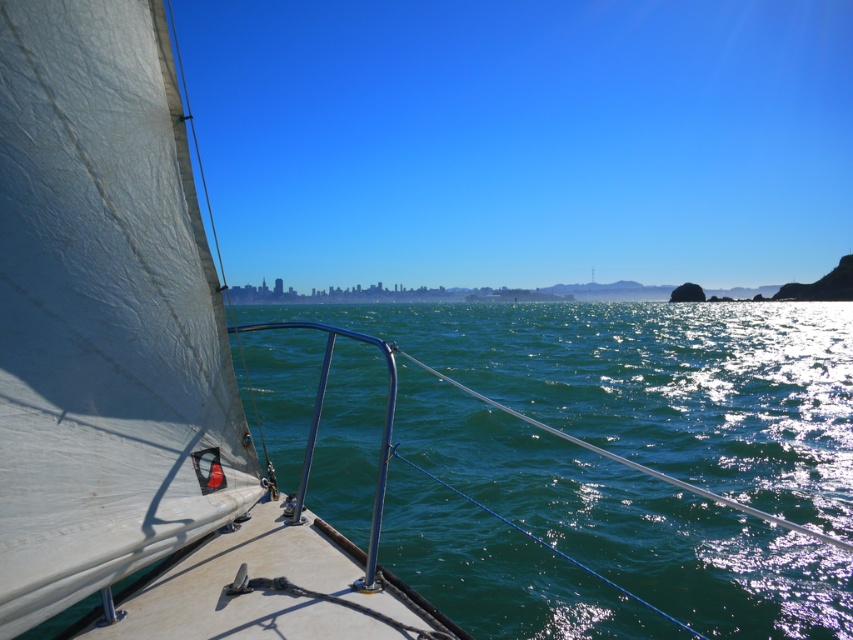
Is white sail at left taller than white matte sail at center?

Yes.

Can you confirm if white sail at left is smaller than white matte sail at center?

Incorrect, white sail at left is not smaller in size than white matte sail at center.

Between point (412, 129) and point (62, 364), which one is positioned behind?

The point (412, 129) is more distant.

Find the location of `white sail at left`. white sail at left is located at coordinates (523, 140).

Is green water at center below white matte sail at center?

Actually, green water at center is above white matte sail at center.

Between green water at center and white matte sail at center, which one is positioned lower?

white matte sail at center

Which is in front, point (639, 570) or point (146, 252)?

Point (146, 252)

Find the location of a particular element. The image size is (853, 640). green water at center is located at coordinates (656, 385).

Does white sail at left appear on the right side of green water at center?

Correct, you'll find white sail at left to the right of green water at center.

Who is more distant from viewer, (x=729, y=182) or (x=479, y=589)?

Positioned behind is point (x=729, y=182).

The width and height of the screenshot is (853, 640). Describe the element at coordinates (523, 140) in the screenshot. I see `white sail at left` at that location.

At what (x,y) coordinates should I click in order to perform the action: click on white sail at left. Please return your answer as a coordinate pair (x, y). The width and height of the screenshot is (853, 640). Looking at the image, I should click on (523, 140).